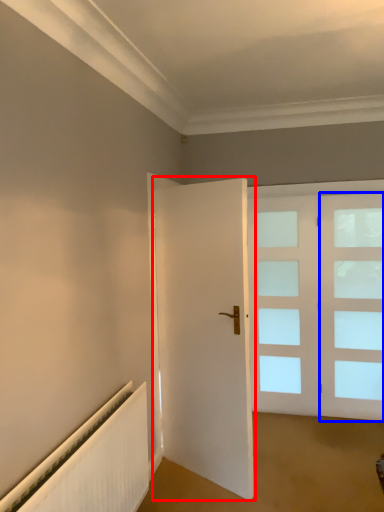
Question: Which object appears closest to the camera in this image, door (highlighted by a red box) or window (highlighted by a blue box)?

Choices:
 (A) door
 (B) window

Answer: (A)